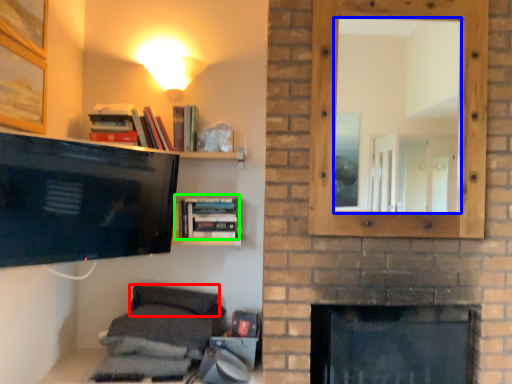
Question: Estimate the real-world distances between objects in this image. Which object is farther from pillow (highlighted by a red box), mirror (highlighted by a blue box) or book (highlighted by a green box)?

Choices:
 (A) mirror
 (B) book

Answer: (A)